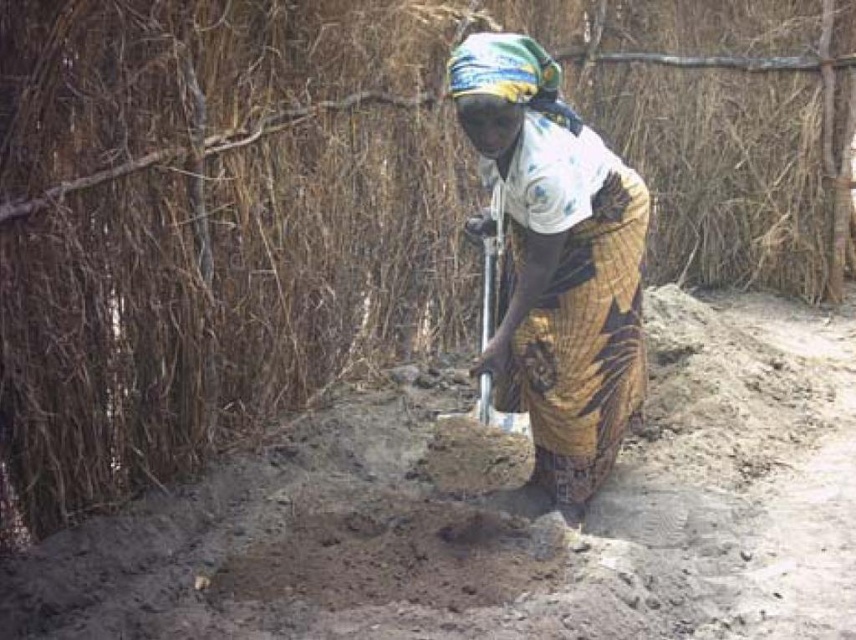
You are a photographer trying to capture a closeup of the printed cotton dress at center and the metallic silver shovel at center in the scene. Your camera can only focus on objects within a 40 centimeter range. Will both items be in focus?

The printed cotton dress at center is 47.16 centimeters from the metallic silver shovel at center, which exceeds the camera focus range of 40 centimeters. Therefore, both items will not be in focus simultaneously.

In the scene shown: You are a farmer in the scene and need to determine which item is wider when looking at the printed cotton dress at center and the metallic silver shovel at center. Which one is wider?

The printed cotton dress at center is wider than the metallic silver shovel at center according to the description provided.

You are standing in the rural outdoor scene and want to move from the point closer to you to the point further away. Which path would you take between the two points, point (531, 244) and point (502, 412)?

The path from point (531, 244) to point (502, 412) is the correct route since point (531, 244) is closer to the viewer and you need to move towards the point (502, 412) which is further away.